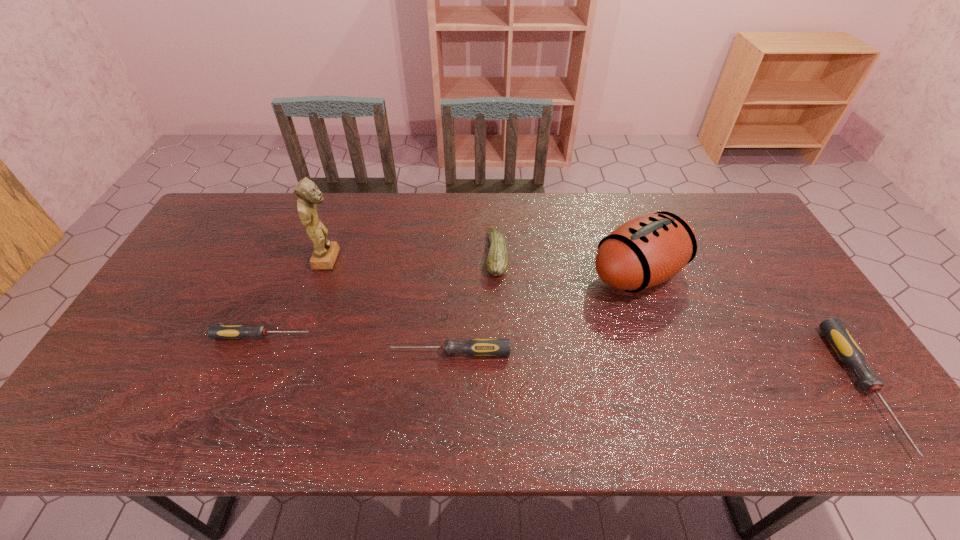
What are the coordinates of `the leftmost screwdriver` in the screenshot? It's located at (215, 331).

At what (x,y) coordinates should I click in order to perform the action: click on the shortest screwdriver. Please return your answer as a coordinate pair (x, y). The height and width of the screenshot is (540, 960). Looking at the image, I should click on (215, 331).

This screenshot has width=960, height=540. What are the coordinates of `the second shortest object` in the screenshot? It's located at (479, 347).

Locate an element on the screen. This screenshot has height=540, width=960. the second screwdriver from left to right is located at coordinates (479, 347).

Image resolution: width=960 pixels, height=540 pixels. What are the coordinates of `the rightmost screwdriver` in the screenshot? It's located at (845, 346).

What are the coordinates of `the second tallest object` in the screenshot? It's located at (646, 251).

Find the location of a particular element. the second object from right to left is located at coordinates (646, 251).

Where is `the third tallest object`? the third tallest object is located at coordinates (497, 261).

You are a GUI agent. You are given a task and a screenshot of the screen. Output one action in this format:
    pyautogui.click(x=<x>, y=<y>)
    Task: Click on the tallest object
    The width and height of the screenshot is (960, 540).
    Given the screenshot: What is the action you would take?
    pyautogui.click(x=325, y=252)

Where is `vacant region located insert the shortest screwdriver into a screw head`? vacant region located insert the shortest screwdriver into a screw head is located at coordinates (418, 336).